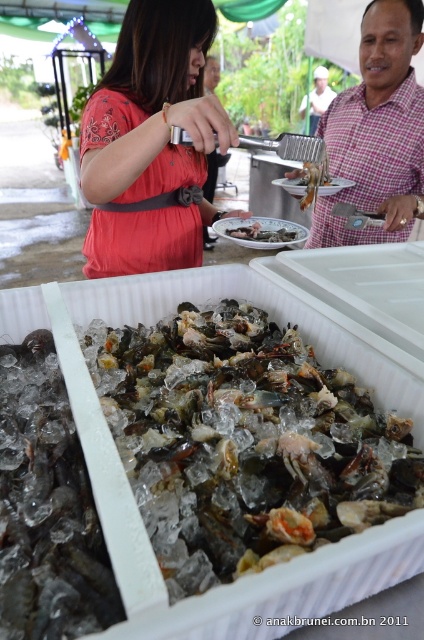
Question: Can you confirm if white checkered shirt at upper right is wider than glossy plastic crab at center?

Choices:
 (A) no
 (B) yes

Answer: (B)

Question: Can you confirm if translucent ice at center is positioned below translucent glass shrimp at center?

Choices:
 (A) no
 (B) yes

Answer: (B)

Question: Which of the following is the farthest from the observer?

Choices:
 (A) (233, 227)
 (B) (334, 148)

Answer: (B)

Question: Which point is farther to the camera?

Choices:
 (A) matte pink dress at center
 (B) translucent glass shrimp at center
 (C) glossy plastic crab at center
 (D) white checkered shirt at upper right

Answer: (D)

Question: From the image, what is the correct spatial relationship of white checkered shirt at upper right in relation to glossy plastic crab at center?

Choices:
 (A) above
 (B) below

Answer: (A)

Question: Among these objects, which one is nearest to the camera?

Choices:
 (A) translucent glass shrimp at center
 (B) plaid fabric shirt at upper right
 (C) matte pink dress at center
 (D) translucent ice at center

Answer: (D)